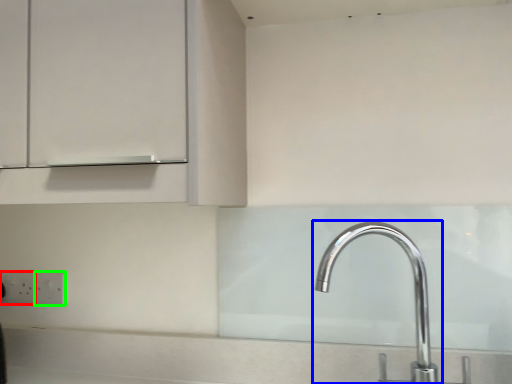
Question: Estimate the real-world distances between objects in this image. Which object is closer to electric outlet (highlighted by a red box), tap (highlighted by a blue box) or electric outlet (highlighted by a green box)?

Choices:
 (A) tap
 (B) electric outlet

Answer: (B)